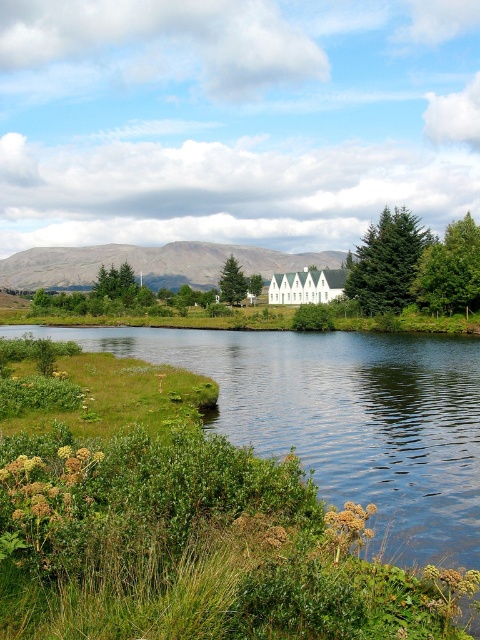
Question: Among these objects, which one is farthest from the camera?

Choices:
 (A) green matte evergreen tree at center-right
 (B) green leafy tree at right

Answer: (A)

Question: Can you confirm if green grassy river at lower center is positioned to the right of green leafy tree at right?

Choices:
 (A) no
 (B) yes

Answer: (A)

Question: In this image, where is green leafy tree at right located relative to green leafy tree at center?

Choices:
 (A) below
 (B) above

Answer: (A)

Question: Which of the following is the farthest from the observer?

Choices:
 (A) green leafy tree at center
 (B) green matte tree at center
 (C) green grassy river at lower center
 (D) green matte evergreen tree at center-right

Answer: (A)

Question: Which object is the closest to the green leafy tree at center?

Choices:
 (A) green leafy tree at right
 (B) green grassy river at lower center

Answer: (A)

Question: Can you confirm if green matte evergreen tree at center-right is positioned to the right of green matte tree at center?

Choices:
 (A) yes
 (B) no

Answer: (A)